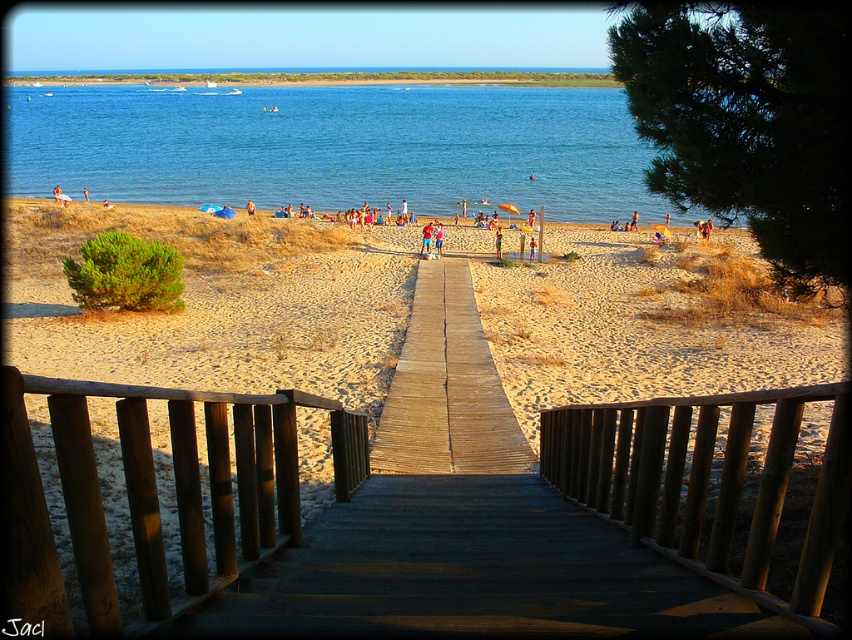
Question: Estimate the real-world distances between objects in this image. Which object is closer to the sandy beach at center?

Choices:
 (A) brown wooden rail at center
 (B) blue water at center

Answer: (A)

Question: Which point is farther to the camera?

Choices:
 (A) (21, 406)
 (B) (452, 353)
 (C) (545, 577)
 (D) (603, 180)

Answer: (D)

Question: Can you confirm if brown wooden rail at center is positioned to the left of wooden boardwalk at center?

Choices:
 (A) yes
 (B) no

Answer: (A)

Question: Which point appears farthest from the camera in this image?

Choices:
 (A) (517, 129)
 (B) (30, 419)
 (C) (96, 508)
 (D) (465, 374)

Answer: (A)

Question: Does sandy beach at center appear on the right side of brown wooden rail at center?

Choices:
 (A) no
 (B) yes

Answer: (B)

Question: Is blue water at center above sandy beach at center?

Choices:
 (A) no
 (B) yes

Answer: (B)